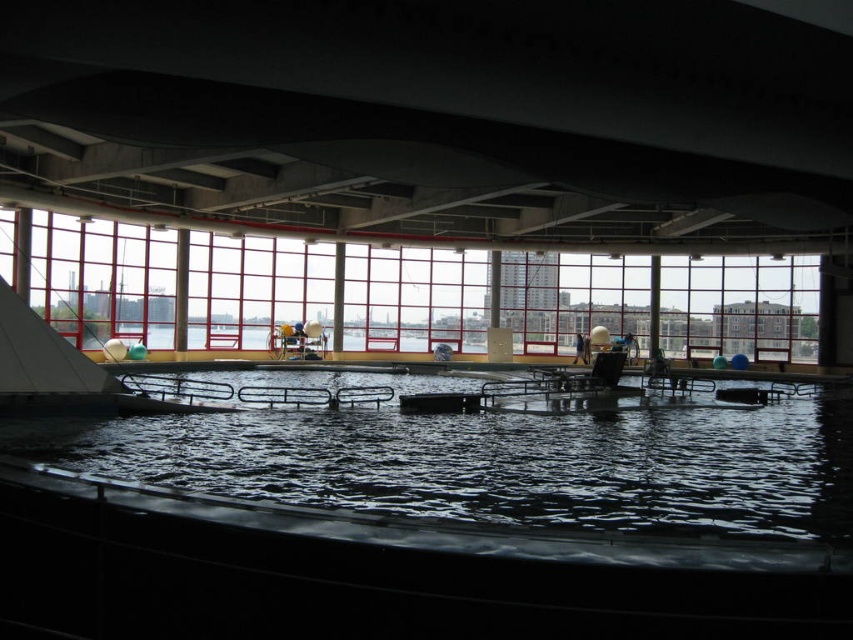
Is point (351, 324) in front of point (587, 352)?

No, it is behind (587, 352).

Who is positioned more to the right, clear glass windows at center or light brown wooden chair at center?

light brown wooden chair at center is more to the right.

Is point (602, 259) behind point (577, 356)?

Yes, it is behind point (577, 356).

The height and width of the screenshot is (640, 853). Find the location of `clear glass windows at center`. clear glass windows at center is located at coordinates (103, 276).

In the scene shown: Can you confirm if clear plastic water at center is bigger than clear glass windows at center?

Actually, clear plastic water at center might be smaller than clear glass windows at center.

Between point (15, 424) and point (78, 234), which one is positioned behind?

The point (78, 234) is more distant.

You are a GUI agent. You are given a task and a screenshot of the screen. Output one action in this format:
    pyautogui.click(x=<x>, y=<y>)
    Task: Click on the clear plastic water at center
    Image resolution: width=853 pixels, height=640 pixels.
    Given the screenshot: What is the action you would take?
    pyautogui.click(x=496, y=464)

Which is below, clear plastic water at center or light brown wooden chair at center?

clear plastic water at center is lower down.

This screenshot has width=853, height=640. Describe the element at coordinates (496, 464) in the screenshot. I see `clear plastic water at center` at that location.

Between point (102, 465) and point (579, 360), which one is positioned in front?

Point (102, 465) is more forward.

What are the coordinates of `clear plastic water at center` in the screenshot? It's located at (496, 464).